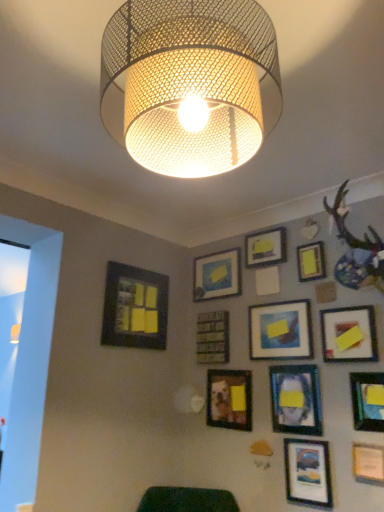
Question: In terms of width, does yellow matte picture frame at upper center, which appears as the fifth picture frame when viewed from the left, look wider or thinner when compared to yellow matte picture frame at upper right, acting as the 9th picture frame starting from the left?

Choices:
 (A) thin
 (B) wide

Answer: (B)

Question: In the image, is yellow matte picture frame at upper center, which appears as the fifth picture frame when viewed from the left, positioned in front of or behind yellow matte picture frame at upper right, acting as the 9th picture frame starting from the left?

Choices:
 (A) behind
 (B) front

Answer: (A)

Question: Which is farther from the wooden frame at center, the 2th picture frame viewed from the left?

Choices:
 (A) matte black picture frame at center, which ranks as the 9th picture frame in right-to-left order
 (B) yellow matte picture frame at upper right, arranged as the fourth picture frame when viewed from the right
 (C) matte black picture frame at lower left, the 1th picture frame when ordered from left to right
 (D) metal mesh lampshade at upper center
 (E) yellow matte picture frame at upper center, which appears as the fifth picture frame when viewed from the left

Answer: (D)

Question: Which of these objects is positioned closest to the yellow matte picture frame at upper center, positioned as the eighth picture frame in right-to-left order?

Choices:
 (A) matte black picture frame at lower left, which appears as the twelfth picture frame when viewed from the right
 (B) wooden frame at center, which is the 11th picture frame in right-to-left order
 (C) matte blue painting at center, which is the 6th picture frame in left-to-right order
 (D) matte black picture frame at lower right, the seventh picture frame positioned from the left
 (E) matte white picture frame at lower right, the eleventh picture frame from the left

Answer: (C)